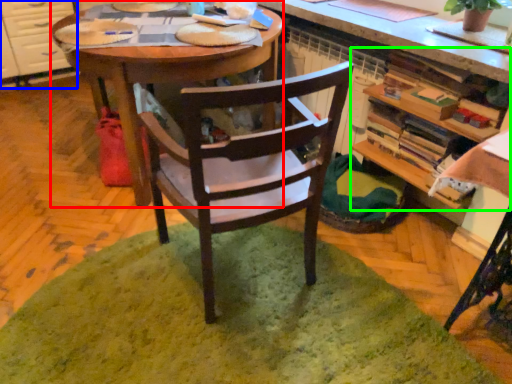
Question: Estimate the real-world distances between objects in this image. Which object is farther from desk (highlighted by a red box), cabinetry (highlighted by a blue box) or shelf (highlighted by a green box)?

Choices:
 (A) cabinetry
 (B) shelf

Answer: (A)